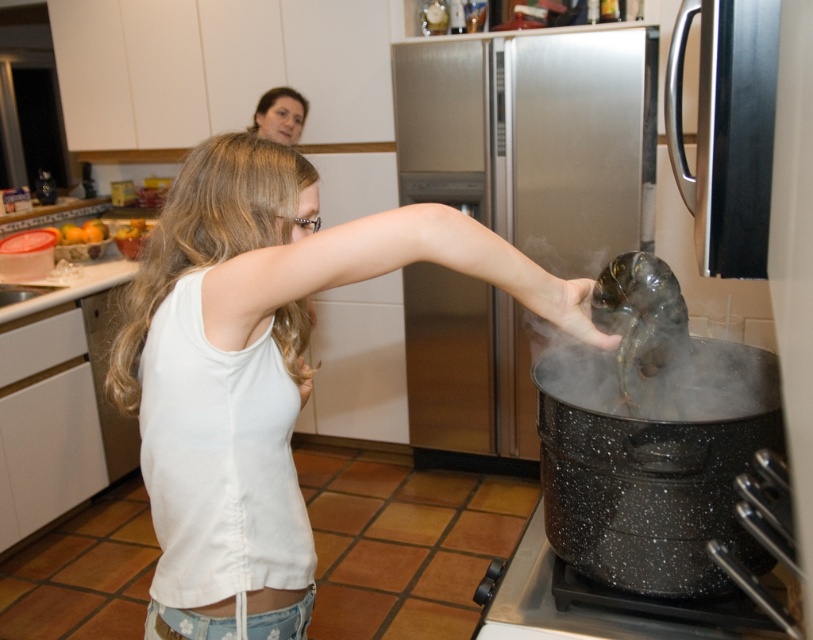
Which of these two, stainless steel refrigerator at center or black speckled pot at lower right, stands taller?

With more height is stainless steel refrigerator at center.

Who is positioned more to the left, stainless steel refrigerator at center or black speckled pot at lower right?

From the viewer's perspective, black speckled pot at lower right appears more on the left side.

The width and height of the screenshot is (813, 640). What do you see at coordinates (535, 138) in the screenshot? I see `stainless steel refrigerator at center` at bounding box center [535, 138].

You are a GUI agent. You are given a task and a screenshot of the screen. Output one action in this format:
    pyautogui.click(x=<x>, y=<y>)
    Task: Click on the stainless steel refrigerator at center
    The width and height of the screenshot is (813, 640).
    Given the screenshot: What is the action you would take?
    pyautogui.click(x=535, y=138)

Can you confirm if satin black refrigerator at right is positioned above shiny metallic fish at center?

Indeed, satin black refrigerator at right is positioned over shiny metallic fish at center.

Is satin black refrigerator at right to the right of shiny metallic fish at center from the viewer's perspective?

Yes, satin black refrigerator at right is to the right of shiny metallic fish at center.

Is point (712, 264) farther from viewer compared to point (600, 292)?

No.

Find the location of a particular element. This screenshot has width=813, height=640. satin black refrigerator at right is located at coordinates (727, 131).

Is white cotton tank top at center bigger than white vapor at pot right?

Yes, white cotton tank top at center is bigger than white vapor at pot right.

Which is above, white cotton tank top at center or white vapor at pot right?

white cotton tank top at center is higher up.

Where is `white cotton tank top at center`? The height and width of the screenshot is (640, 813). white cotton tank top at center is located at coordinates (x=261, y=369).

You are a GUI agent. You are given a task and a screenshot of the screen. Output one action in this format:
    pyautogui.click(x=<x>, y=<y>)
    Task: Click on the white cotton tank top at center
    
    Given the screenshot: What is the action you would take?
    pyautogui.click(x=261, y=369)